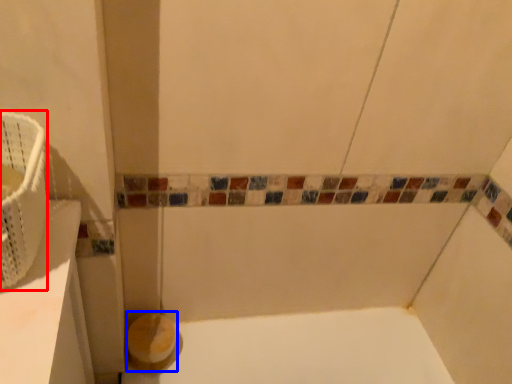
Question: Which of the following is the closest to the observer, basket (highlighted by a red box) or toilet paper (highlighted by a blue box)?

Choices:
 (A) basket
 (B) toilet paper

Answer: (A)